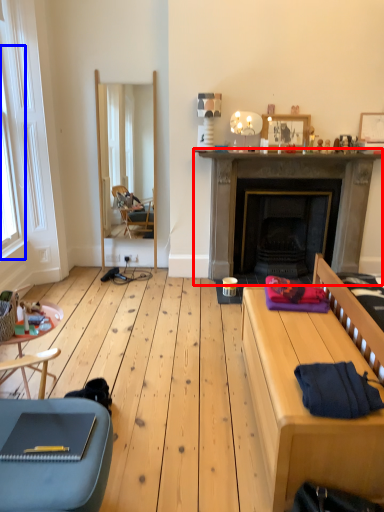
Question: Which point is further to the camera, fireplace (highlighted by a red box) or window (highlighted by a blue box)?

Choices:
 (A) fireplace
 (B) window

Answer: (A)